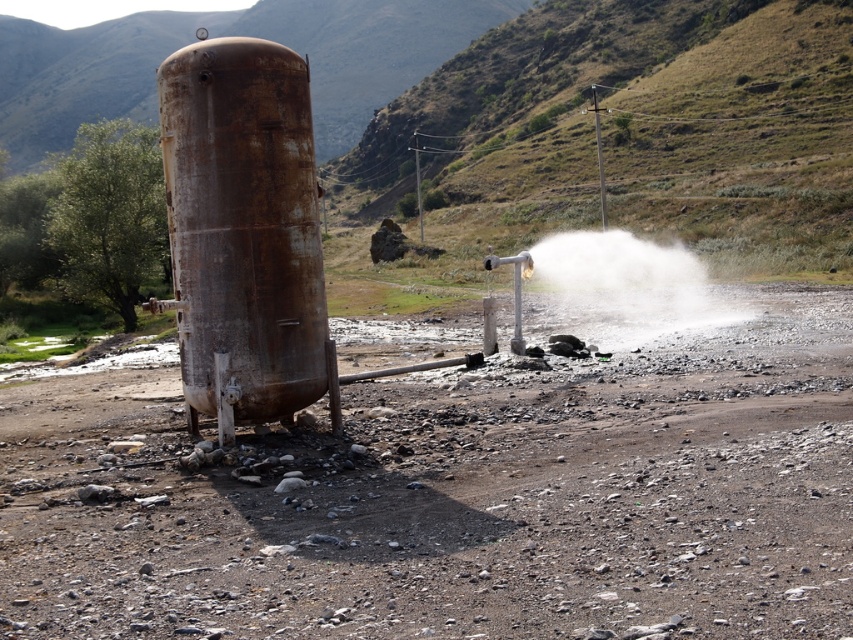
Between rusty metallic tank at center-left and rusty metal water tower at center, which one is positioned lower?

rusty metallic tank at center-left is below.

Who is more distant from viewer, (3,472) or (241,88)?

The point (241,88) is more distant.

The width and height of the screenshot is (853, 640). In order to click on rusty metallic tank at center-left in this screenshot , I will do `click(457, 500)`.

Who is shorter, rusty metallic tank at center-left or white powdery steam at center?

With less height is rusty metallic tank at center-left.

Identify the location of rusty metallic tank at center-left. This screenshot has width=853, height=640. (457, 500).

Which is behind, point (149, 400) or point (572, 282)?

Positioned behind is point (572, 282).

Where is `rusty metallic tank at center-left`? rusty metallic tank at center-left is located at coordinates (457, 500).

Does rusty metal water tower at center have a greater height compared to white powdery steam at center?

No.

Which is below, rusty metal water tower at center or white powdery steam at center?

rusty metal water tower at center is below.

Image resolution: width=853 pixels, height=640 pixels. I want to click on rusty metal water tower at center, so click(x=242, y=232).